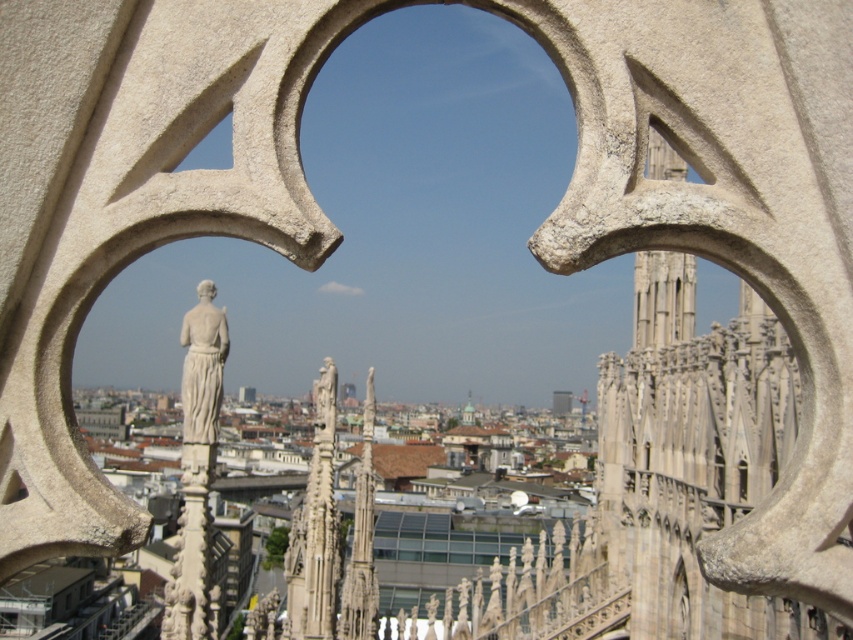
You are an architect analyzing the layout of this historic building. Given that the stone gothic spire at upper right is located at coordinates point 0.466, 0.778, can you determine its placement relative to the center of the image?

The stone gothic spire at upper right is positioned at coordinates point (663,298), which places it to the right and slightly below the center of the image.

You are an architect analyzing the proportions of architectural elements in the scene. Which object, the stone gothic spire at upper right or the white marble statue at center, would you recommend scaling down to maintain visual harmony between the two?

The stone gothic spire at upper right is larger in size than the white marble statue at center. To maintain visual harmony, it would be advisable to scale down the stone gothic spire at upper right to match the size of the white marble statue at center.

You are an architect analyzing the structural integrity of the stone gothic spire at upper right and the white marble statue at center. Based on their widths, which one might require more reinforcement to prevent collapse?

The stone gothic spire at upper right might require more reinforcement than the white marble statue at center because it might be wider, making it less stable and more prone to structural stress.